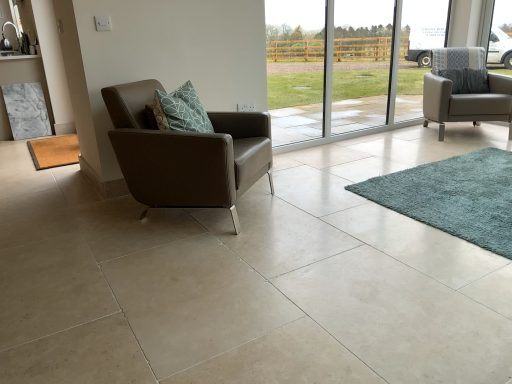
Locate an element on the screen. The height and width of the screenshot is (384, 512). vacant space underneath brown leather armchair at left, which appears as the second chair when viewed from the right (from a real-world perspective) is located at coordinates (194, 213).